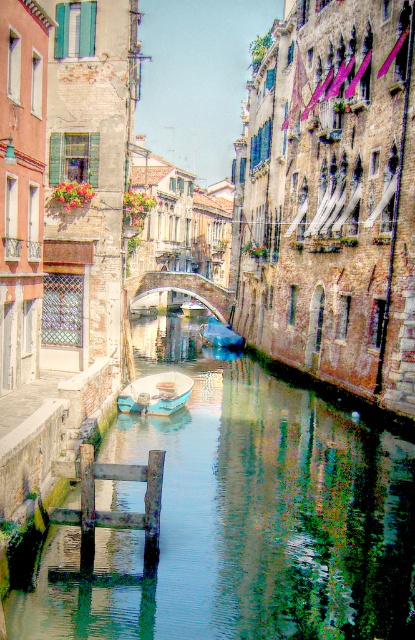
Question: Which of the following is the closest to the observer?

Choices:
 (A) (146, 404)
 (B) (234, 339)
 (C) (187, 308)

Answer: (A)

Question: Is blue painted wooden boat at center thinner than blue glossy boat at center?

Choices:
 (A) no
 (B) yes

Answer: (B)

Question: Can you confirm if blue painted wooden boat at center is bigger than blue glossy boat at center?

Choices:
 (A) yes
 (B) no

Answer: (A)

Question: Which of the following is the closest to the observer?

Choices:
 (A) blue glossy boat at center
 (B) blue painted wooden boat at center
 (C) greenish water at center

Answer: (C)

Question: Does stone arch bridge at center have a greater width compared to white plastic boat at center?

Choices:
 (A) no
 (B) yes

Answer: (B)

Question: Which object appears farthest from the camera in this image?

Choices:
 (A) stone arch bridge at center
 (B) blue painted wooden boat at center
 (C) white plastic boat at center

Answer: (C)